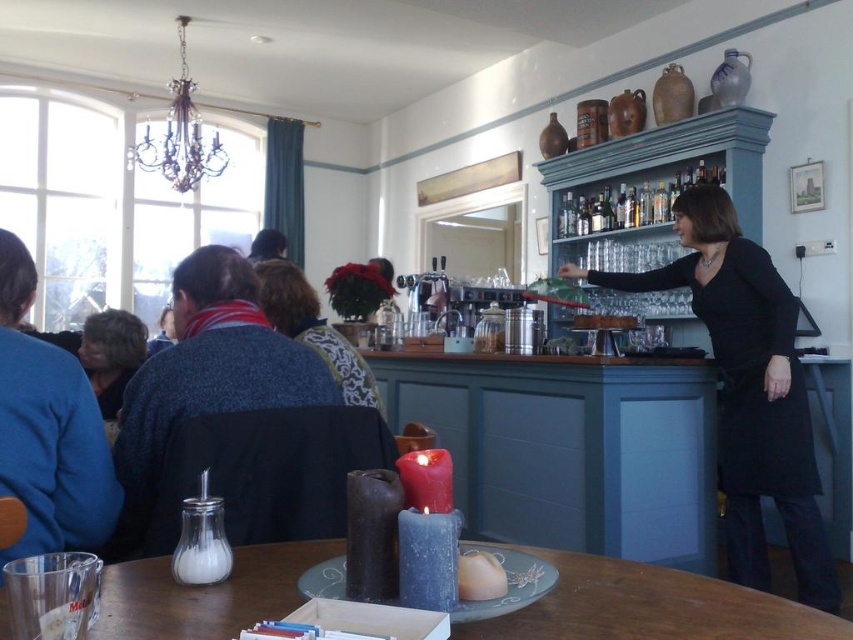
Question: Which point is closer to the camera?

Choices:
 (A) (717, 177)
 (B) (335, 344)
 (C) (247, 580)

Answer: (C)

Question: Can you confirm if black matte dress at right is smaller than blonde hair at left?

Choices:
 (A) no
 (B) yes

Answer: (A)

Question: Does wooden table at center have a smaller size compared to shiny glass bottles at upper center?

Choices:
 (A) no
 (B) yes

Answer: (B)

Question: Among these points, which one is nearest to the camera?

Choices:
 (A) (260, 264)
 (B) (122, 316)
 (C) (573, 221)

Answer: (B)

Question: Which object is closer to the camera taking this photo?

Choices:
 (A) black matte dress at right
 (B) wooden table at center

Answer: (B)

Question: Is velvet blue scarf at center to the right of shiny glass bottles at upper center from the viewer's perspective?

Choices:
 (A) no
 (B) yes

Answer: (A)